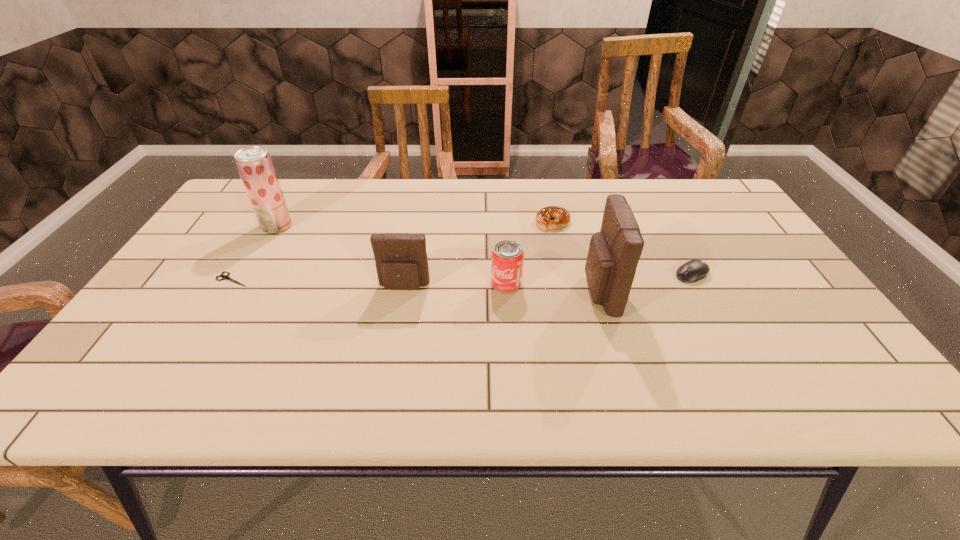
What are the coordinates of `the third object from left to right` in the screenshot? It's located at (401, 260).

You are a GUI agent. You are given a task and a screenshot of the screen. Output one action in this format:
    pyautogui.click(x=<x>, y=<y>)
    Task: Click on the shorter pouch
    This screenshot has width=960, height=540.
    Given the screenshot: What is the action you would take?
    pyautogui.click(x=401, y=260)

Identify the location of the taller pouch. (614, 252).

You are a GUI agent. You are given a task and a screenshot of the screen. Output one action in this format:
    pyautogui.click(x=<x>, y=<y>)
    Task: Click on the fruit juice
    
    Given the screenshot: What is the action you would take?
    pyautogui.click(x=254, y=164)

Image resolution: width=960 pixels, height=540 pixels. Identify the location of bagel. (562, 217).

The width and height of the screenshot is (960, 540). Identify the location of can. (507, 257).

Locate an element on the screen. The width and height of the screenshot is (960, 540). the fourth object from right to left is located at coordinates (507, 257).

Find the location of a particular element. This screenshot has height=540, width=960. shears is located at coordinates (224, 277).

Identify the location of computer mouse. (692, 271).

You are a GUI agent. You are given a task and a screenshot of the screen. Output one action in this format:
    pyautogui.click(x=<x>, y=<y>)
    Task: Click on the vacant space located 0.170m with an open flap on the third tallest object
    The image size is (960, 540).
    Given the screenshot: What is the action you would take?
    pyautogui.click(x=393, y=349)